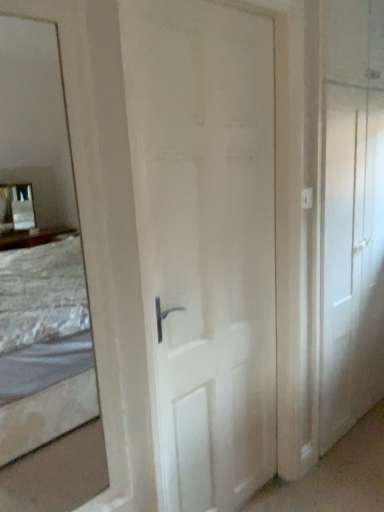
Question: Looking at their shapes, would you say white matte door at right, the second door viewed from the left, is wider or thinner than white matte door at center, which is the 1th door in left-to-right order?

Choices:
 (A) thin
 (B) wide

Answer: (A)

Question: Considering the positions of white matte door at right, the second door viewed from the left, and white matte door at center, which appears as the second door when viewed from the right, in the image, is white matte door at right, the second door viewed from the left, bigger or smaller than white matte door at center, which appears as the second door when viewed from the right,?

Choices:
 (A) small
 (B) big

Answer: (B)

Question: Based on their positions, is white matte door at right, the second door viewed from the left, located to the left or right of white matte door at center, which appears as the second door when viewed from the right?

Choices:
 (A) left
 (B) right

Answer: (B)

Question: Which is correct: white matte door at center, which is the 1th door in left-to-right order, is inside white matte door at right, the second door viewed from the left, or outside of it?

Choices:
 (A) inside
 (B) outside

Answer: (B)

Question: In terms of width, does white matte door at center, which is the 1th door in left-to-right order, look wider or thinner when compared to white matte door at right, marked as the 1th door in a right-to-left arrangement?

Choices:
 (A) thin
 (B) wide

Answer: (B)

Question: Based on their positions, is white matte door at center, which is the 1th door in left-to-right order, located to the left or right of white matte door at right, the second door viewed from the left?

Choices:
 (A) left
 (B) right

Answer: (A)

Question: From the image's perspective, relative to white matte door at right, the second door viewed from the left, is white matte door at center, which is the 1th door in left-to-right order, above or below?

Choices:
 (A) above
 (B) below

Answer: (B)